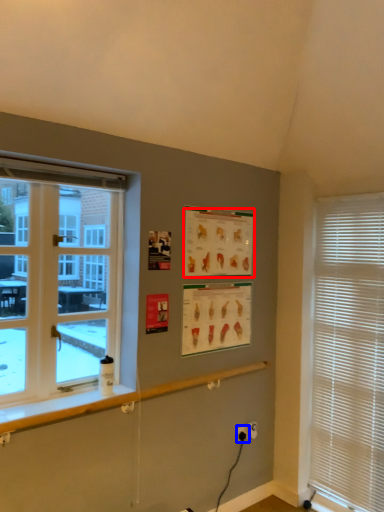
Question: Among these objects, which one is nearest to the camera, poster page (highlighted by a red box) or electric outlet (highlighted by a blue box)?

Choices:
 (A) poster page
 (B) electric outlet

Answer: (A)